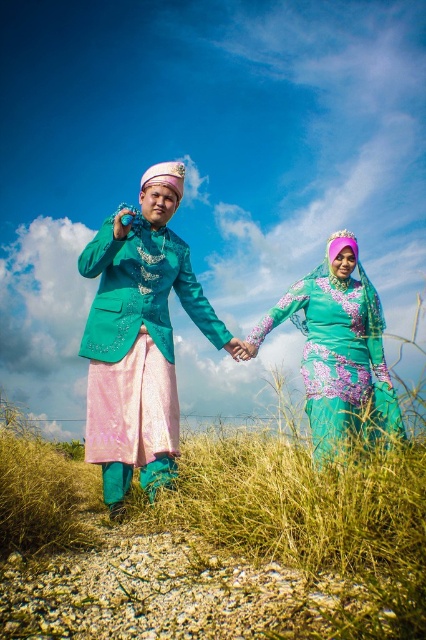
You are a photographer planning to take a photo of the scene described. The scene includes a point marked at coordinates (x=141, y=337). What object is located at this point?

The point at coordinates (x=141, y=337) indicates the location of the satin teal dress at center.

You are standing in the scene and want to place a small flag at one of the two points, point 1 at point (161, 212) and point 2 at point (365, 308). Which point is closer to you so the flag will be more visible?

Point 1 at point (161, 212) is closer to the camera than point 2 at point (365, 308), so placing the flag there will make it more visible.

You are a photographer taking a picture of the scene. You want to ensure the satin teal dress at center and the teal floral dress at center are positioned correctly. According to the scene description, which dress is positioned to the left of the other?

The satin teal dress at center is positioned to the left of the teal floral dress at center.